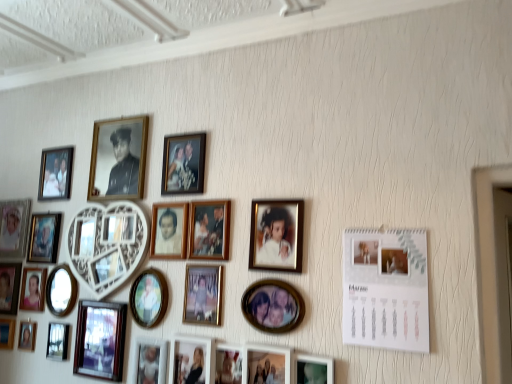
Question: Considering the relative sizes of matte black picture frame at center, placed as the 9th picture frame when sorted from right to left, and matte black photo frame at lower right, which appears as the 2th picture frame when viewed from the right, in the image provided, is matte black picture frame at center, placed as the 9th picture frame when sorted from right to left, shorter than matte black photo frame at lower right, which appears as the 2th picture frame when viewed from the right,?

Choices:
 (A) yes
 (B) no

Answer: (B)

Question: From the image's perspective, would you say matte black picture frame at center, the 17th picture frame from the left, is shown under matte black photo frame at lower right, which appears as the 2th picture frame when viewed from the right?

Choices:
 (A) yes
 (B) no

Answer: (A)

Question: Is matte black picture frame at center, placed as the 9th picture frame when sorted from right to left, at the left side of matte black photo frame at lower right, the 24th picture frame positioned from the left?

Choices:
 (A) yes
 (B) no

Answer: (A)

Question: Considering the relative sizes of matte black picture frame at center, placed as the 9th picture frame when sorted from right to left, and matte black photo frame at lower right, the 24th picture frame positioned from the left, in the image provided, is matte black picture frame at center, placed as the 9th picture frame when sorted from right to left, taller than matte black photo frame at lower right, the 24th picture frame positioned from the left,?

Choices:
 (A) no
 (B) yes

Answer: (B)

Question: From a real-world perspective, is matte black picture frame at center, placed as the 9th picture frame when sorted from right to left, positioned over matte black photo frame at lower right, which appears as the 2th picture frame when viewed from the right, based on gravity?

Choices:
 (A) no
 (B) yes

Answer: (A)

Question: Can you confirm if matte black picture frame at center, the 17th picture frame from the left, is wider than matte black photo frame at lower right, the 24th picture frame positioned from the left?

Choices:
 (A) yes
 (B) no

Answer: (A)

Question: Is matte black photo frame at lower left, marked as the 22th picture frame in a right-to-left arrangement, taller than matte gold picture frame at center, arranged as the 10th picture frame when viewed from the right?

Choices:
 (A) no
 (B) yes

Answer: (A)

Question: Does matte black photo frame at lower left, marked as the 22th picture frame in a right-to-left arrangement, appear on the left side of matte gold picture frame at center, which is the 16th picture frame in left-to-right order?

Choices:
 (A) yes
 (B) no

Answer: (A)

Question: Is matte black photo frame at lower left, marked as the 22th picture frame in a right-to-left arrangement, surrounding matte gold picture frame at center, which is the 16th picture frame in left-to-right order?

Choices:
 (A) yes
 (B) no

Answer: (B)

Question: Is matte black photo frame at lower left, marked as the 22th picture frame in a right-to-left arrangement, beside matte gold picture frame at center, which is the 16th picture frame in left-to-right order?

Choices:
 (A) yes
 (B) no

Answer: (B)

Question: Is matte black photo frame at lower left, marked as the 22th picture frame in a right-to-left arrangement, far from matte gold picture frame at center, arranged as the 10th picture frame when viewed from the right?

Choices:
 (A) no
 (B) yes

Answer: (A)

Question: Is matte black photo frame at lower left, the 4th picture frame from the left, bigger than matte gold picture frame at center, which is the 16th picture frame in left-to-right order?

Choices:
 (A) no
 (B) yes

Answer: (A)

Question: From a real-world perspective, does matte gold picture frame at center, which appears as the thirteenth picture frame when viewed from the left, stand above gold metallic photo frame at center, placed as the 4th picture frame when sorted from right to left?

Choices:
 (A) no
 (B) yes

Answer: (A)